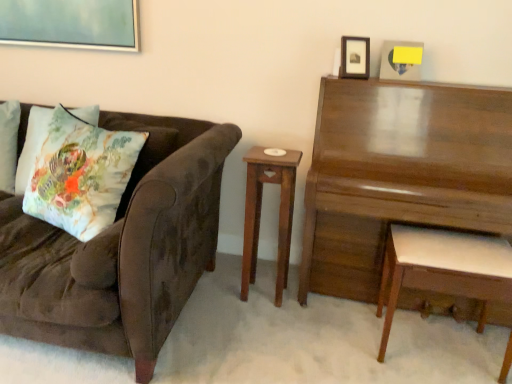
Locate an element on the screen. free space in front of wooden nightstand at center is located at coordinates (262, 323).